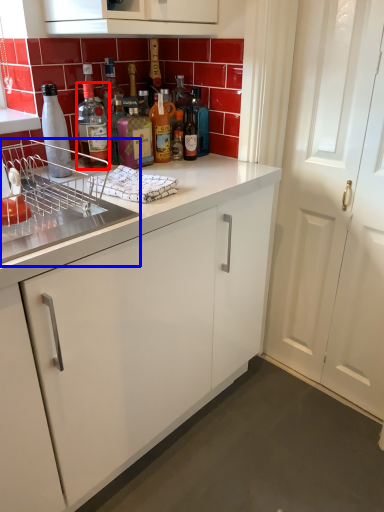
Question: Which of the following is the closest to the observer, bottle (highlighted by a red box) or appliance (highlighted by a blue box)?

Choices:
 (A) bottle
 (B) appliance

Answer: (B)